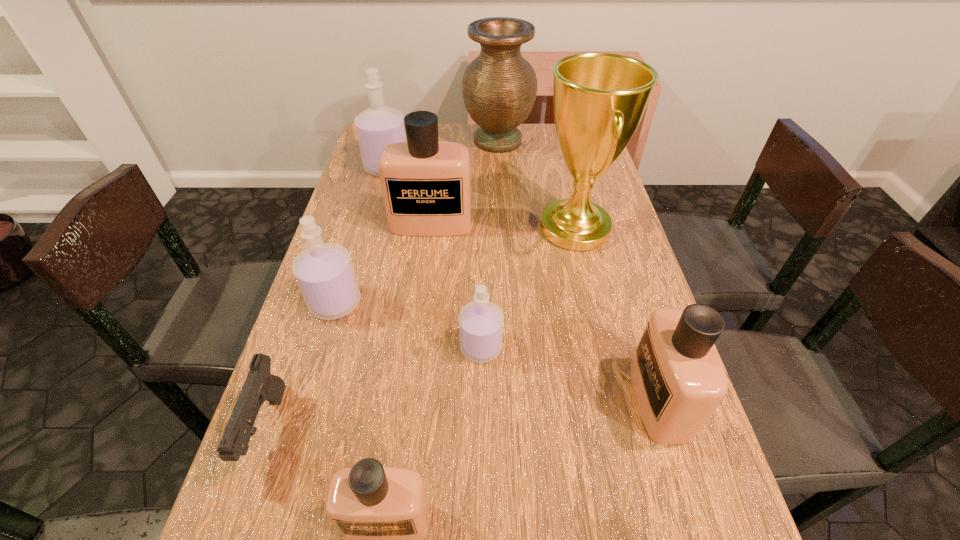
What are the coordinates of `free location at the left edge of the desktop` in the screenshot? It's located at (261, 504).

Identify the location of free space at the right edge of the desktop. Image resolution: width=960 pixels, height=540 pixels. (631, 240).

Find the location of a particular element. The height and width of the screenshot is (540, 960). vacant position at the far right corner of the desktop is located at coordinates (559, 143).

Locate an element on the screen. This screenshot has height=540, width=960. vacant area between the shortest object and the nearest purple perfume is located at coordinates (373, 388).

I want to click on free space between the farthest beige perfume and the fifth nearest object, so click(x=383, y=263).

Image resolution: width=960 pixels, height=540 pixels. Identify the location of free space between the rightmost perfume and the biggest beige perfume. (545, 312).

At what (x,y) coordinates should I click in order to perform the action: click on free space between the rightmost beige perfume and the rightmost purple perfume. Please return your answer as a coordinate pair (x, y). Looking at the image, I should click on (570, 373).

What are the coordinates of `free spot between the second farthest perfume and the pistol` in the screenshot? It's located at (348, 326).

This screenshot has height=540, width=960. I want to click on object that stands as the fifth closest to the shortest object, so click(599, 99).

Select which object is the eighth closest to the farthest purple perfume. Please provide its 2D coordinates. Your answer should be formatted as a tuple, i.e. [(x, y)], where the tuple contains the x and y coordinates of a point satisfying the conditions above.

[(383, 512)]